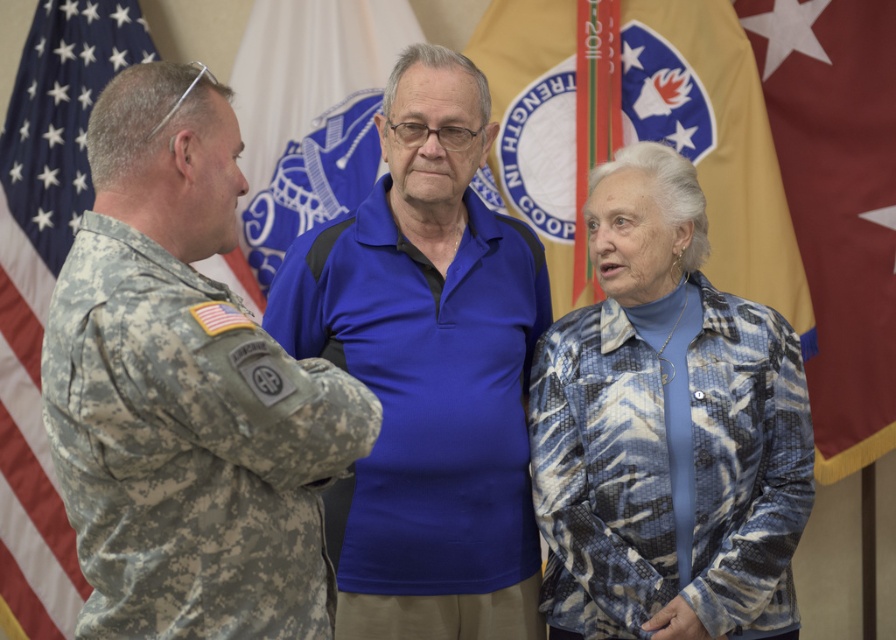
Question: Can you confirm if camouflage uniform at left is bigger than blue textured jacket at center?

Choices:
 (A) no
 (B) yes

Answer: (A)

Question: In this image, where is camouflage uniform at left located relative to blue jersey at center?

Choices:
 (A) below
 (B) above

Answer: (B)

Question: Can you confirm if blue textured jacket at center is smaller than yellow fabric flag at upper center?

Choices:
 (A) no
 (B) yes

Answer: (A)

Question: Estimate the real-world distances between objects in this image. Which object is farther from the blue textured jacket at center?

Choices:
 (A) red fabric flag at right
 (B) blue jersey at center
 (C) blue fabric flag at center
 (D) camouflage fabric flag at left

Answer: (D)

Question: Which point is closer to the camera taking this photo?

Choices:
 (A) (87, 486)
 (B) (557, 244)

Answer: (A)

Question: Which object is closer to the camera taking this photo?

Choices:
 (A) blue fabric flag at center
 (B) red fabric flag at right
 (C) blue textured jacket at center

Answer: (C)